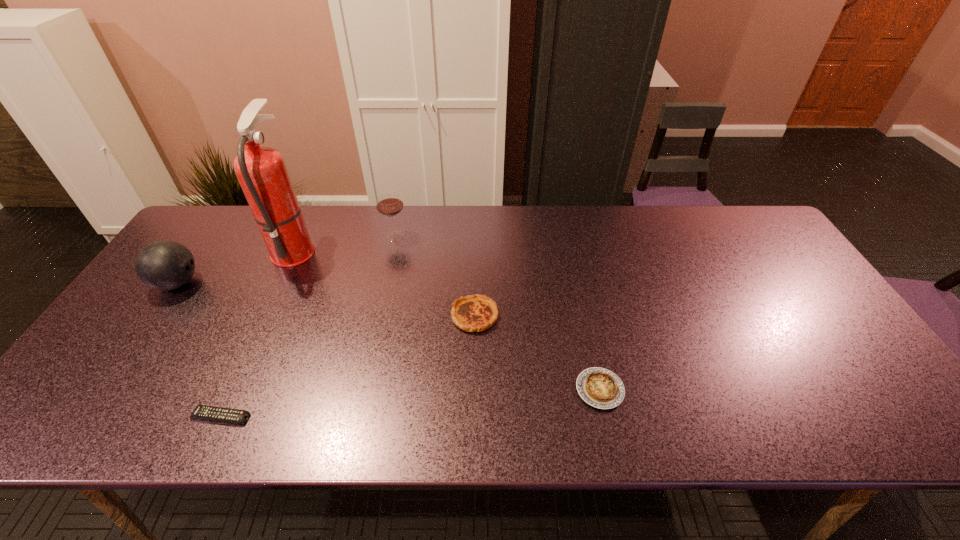
Identify the location of vacant space that satisfies the following two spatial constraints: 1. on the grip area of the leftmost object; 2. on the right side of the shortest object. (84, 416).

Locate an element on the screen. free space that satisfies the following two spatial constraints: 1. on the grip area of the bowling ball; 2. on the left side of the left quiche is located at coordinates (155, 316).

Find the location of a particular element. The height and width of the screenshot is (540, 960). free point that satisfies the following two spatial constraints: 1. on the back side of the remote control; 2. on the grip area of the bowling ball is located at coordinates (281, 283).